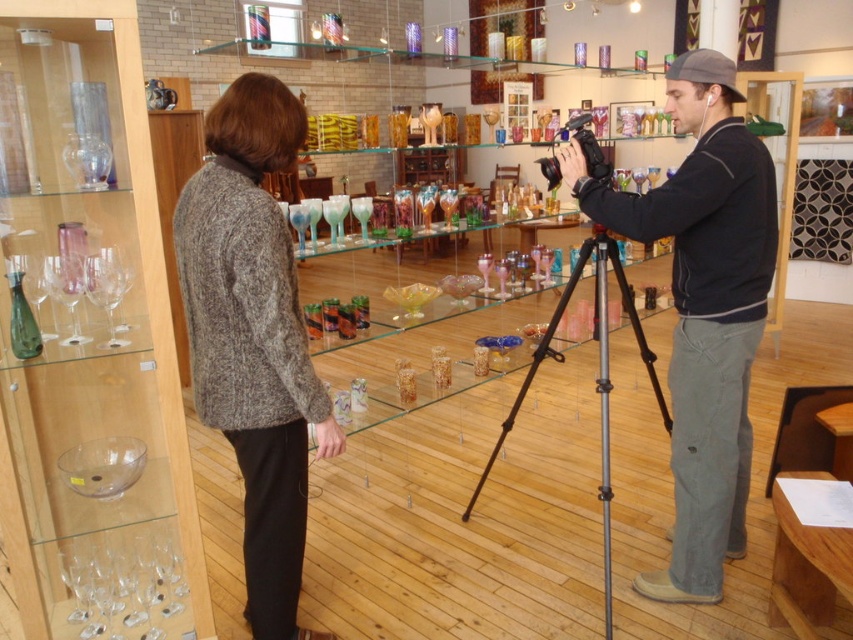
You are a photographer trying to decide where to place a new tripod in this scene. The tripod needs to be positioned between the knitted sweater at center and the black plastic video camera at center. Since both are at the center, how can you determine which side to place it on?

The knitted sweater at center is taller than the black plastic video camera at center. You should place the tripod on the side of the black plastic video camera at center because it is shorter and less likely to block the view of the taller knitted sweater at center.

You are a photographer in the scene and you want to adjust the lighting on the knitted sweater at center and dark gray sweatshirt at center. Since you can only move one item, which one should you move to the right to ensure both items are evenly lit?

You should move the dark gray sweatshirt at center to the right so that it aligns with the knitted sweater at center, which is currently to the left of it. This adjustment will help balance the lighting between both items.